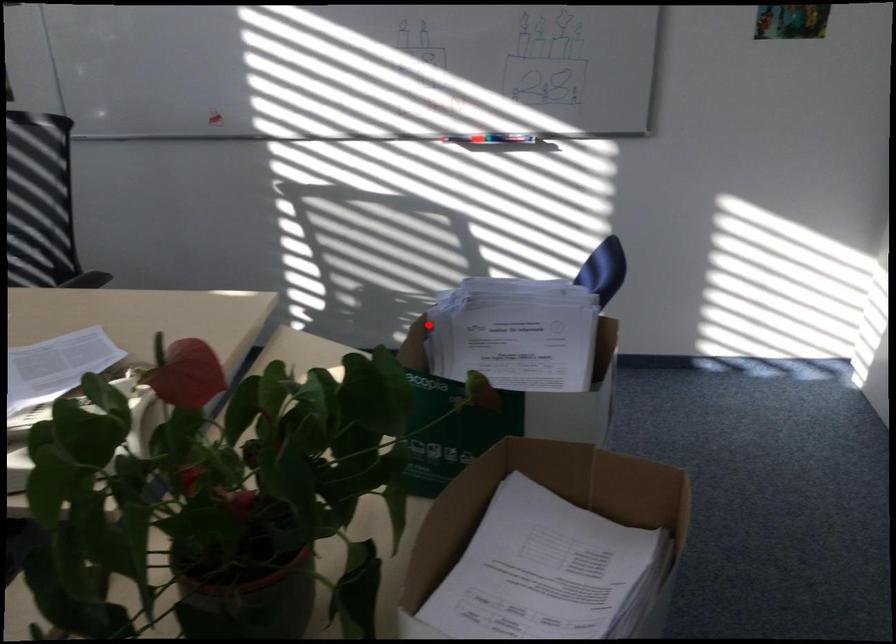
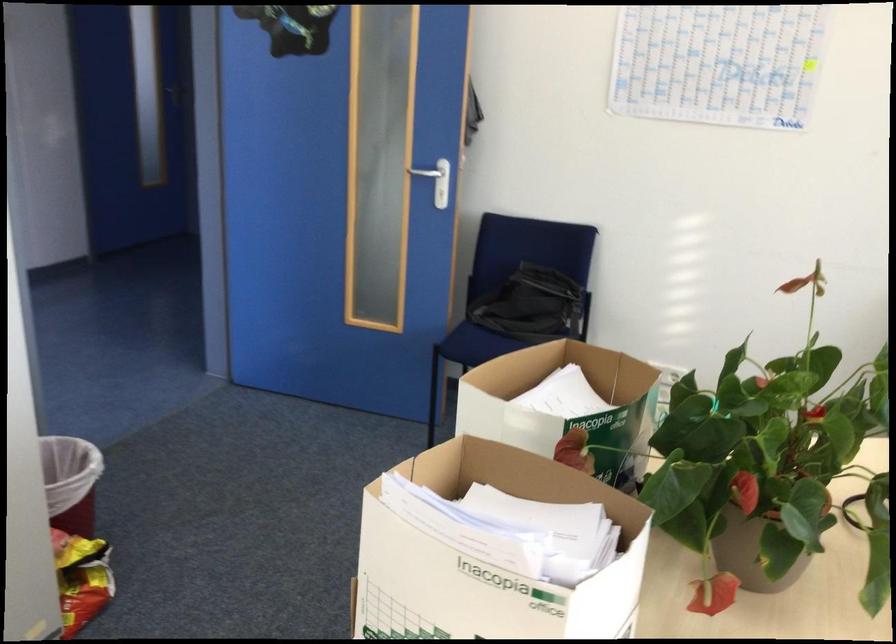
The point at the highlighted location is marked in the first image. Where is the corresponding point in the second image?

(489, 558)